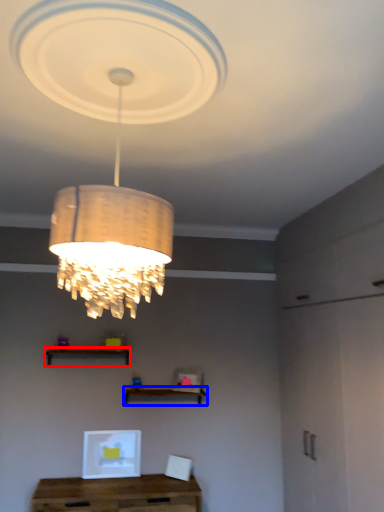
Question: Which of the following is the closest to the observer, shelf (highlighted by a red box) or shelf (highlighted by a blue box)?

Choices:
 (A) shelf
 (B) shelf

Answer: (A)